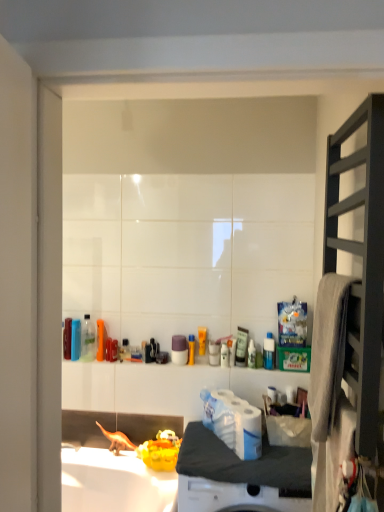
Where is `vacant space in front of white glossy toilet paper at center`? vacant space in front of white glossy toilet paper at center is located at coordinates (246, 463).